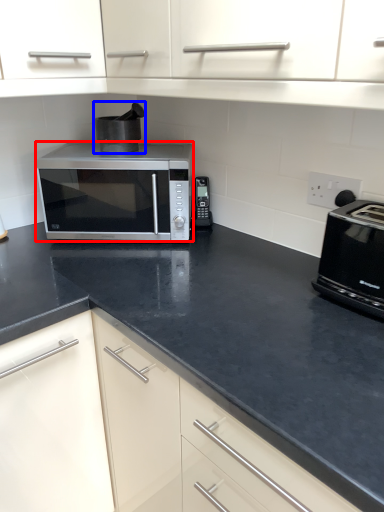
Question: Which of the following is the farthest to the observer, microwave oven (highlighted by a red box) or appliance (highlighted by a blue box)?

Choices:
 (A) microwave oven
 (B) appliance

Answer: (B)